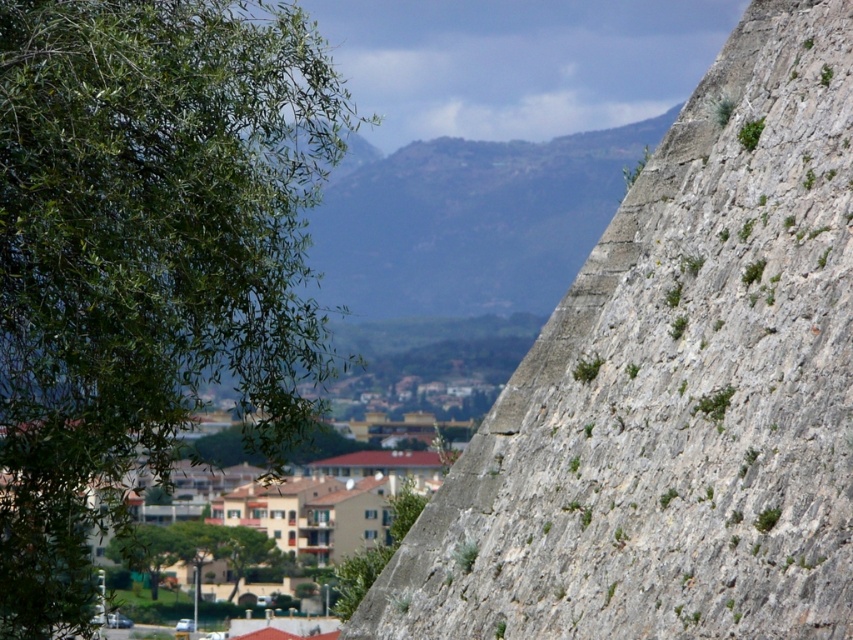
Based on the photo, how distant is gray rough stone wall at right from green leafy tree at left?

gray rough stone wall at right is 13.50 meters away from green leafy tree at left.

Who is shorter, gray rough stone wall at right or green leafy tree at left?

gray rough stone wall at right is shorter.

Which is in front, point (527, 429) or point (68, 336)?

Point (527, 429)

You are a GUI agent. You are given a task and a screenshot of the screen. Output one action in this format:
    pyautogui.click(x=<x>, y=<y>)
    Task: Click on the gray rough stone wall at right
    The height and width of the screenshot is (640, 853).
    Given the screenshot: What is the action you would take?
    pyautogui.click(x=675, y=390)

Can you confirm if gray rough stone wall at right is wider than green leafy tree at lower center?

Indeed, gray rough stone wall at right has a greater width compared to green leafy tree at lower center.

Measure the distance between gray rough stone wall at right and camera.

35.99 meters

Locate an element on the screen. Image resolution: width=853 pixels, height=640 pixels. gray rough stone wall at right is located at coordinates (675, 390).

Measure the distance between point (38, 266) and camera.

Point (38, 266) and camera are 68.65 meters apart from each other.

Between point (65, 291) and point (264, 554), which one is positioned behind?

Point (264, 554)

Describe the element at coordinates (144, 257) in the screenshot. I see `green leafy tree at left` at that location.

Find the location of a particular element. This screenshot has width=853, height=640. green leafy tree at left is located at coordinates (144, 257).